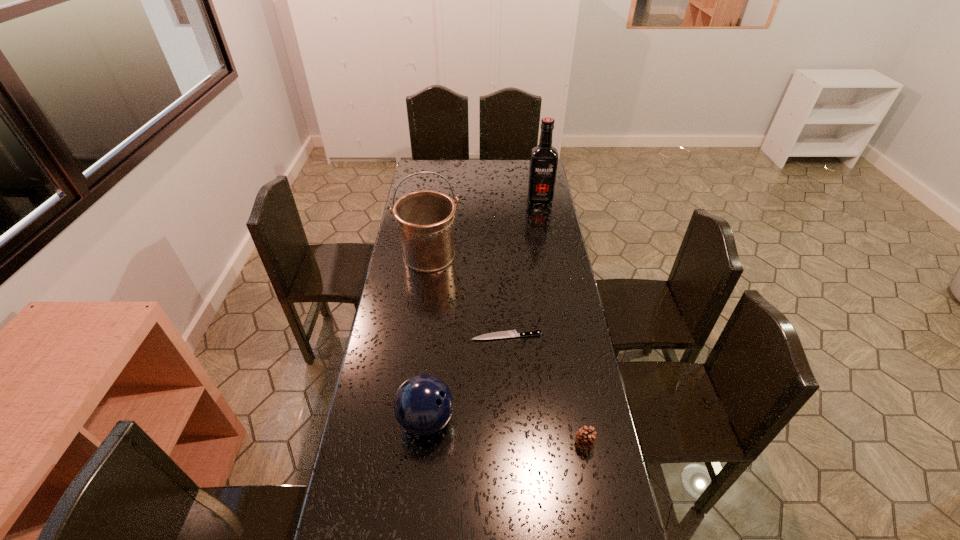
Where is `vacant space located 0.190m on the back of the third nearest object`? vacant space located 0.190m on the back of the third nearest object is located at coordinates (504, 294).

Identify the location of bucket that is at the left edge. The height and width of the screenshot is (540, 960). (425, 219).

What are the coordinates of `bowling ball situated at the left edge` in the screenshot? It's located at (423, 404).

The width and height of the screenshot is (960, 540). In order to click on liquor present at the right edge in this screenshot , I will do `click(543, 163)`.

This screenshot has height=540, width=960. I want to click on pinecone that is positioned at the right edge, so (585, 438).

Locate an element on the screen. This screenshot has width=960, height=540. steak knife present at the right edge is located at coordinates (511, 333).

The image size is (960, 540). Identify the location of vacant space at the left edge. (416, 363).

This screenshot has height=540, width=960. In the image, there is a desktop. What are the coordinates of `vacant region at the right edge` in the screenshot? It's located at (576, 374).

Image resolution: width=960 pixels, height=540 pixels. In order to click on vacant space at the far right corner of the desktop in this screenshot , I will do `click(521, 171)`.

You are a GUI agent. You are given a task and a screenshot of the screen. Output one action in this format:
    pyautogui.click(x=<x>, y=<y>)
    Task: Click on the free space between the pinecone and the bowling ball
    The height and width of the screenshot is (540, 960).
    Given the screenshot: What is the action you would take?
    pyautogui.click(x=505, y=431)